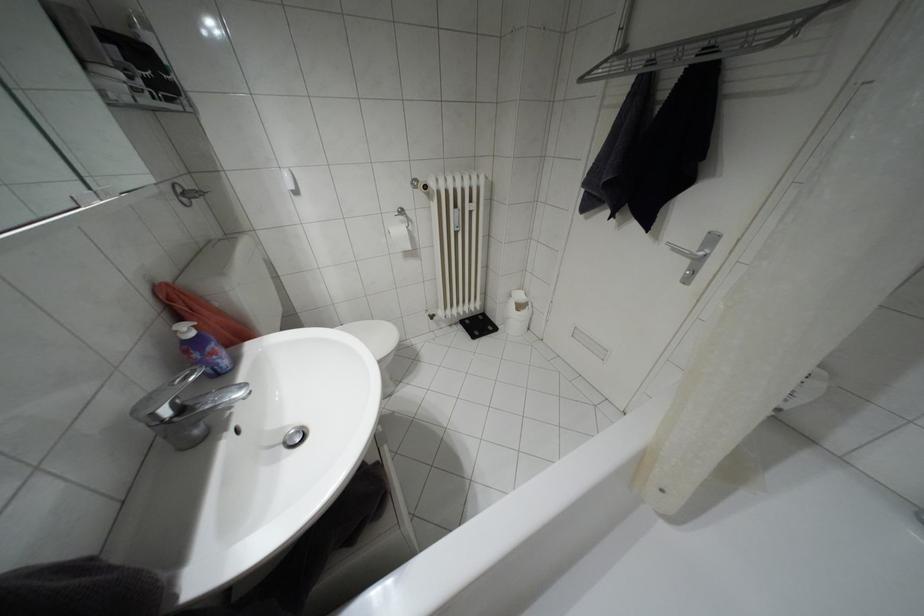
The height and width of the screenshot is (616, 924). What are the coordinates of `sink faucet handle` in the screenshot? It's located at (164, 399).